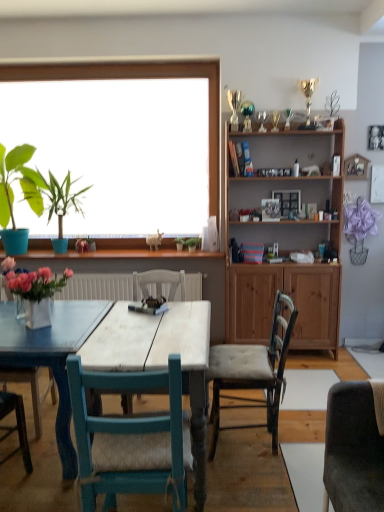
The image size is (384, 512). Identify the location of green leafy plant in blue pot at left. (13, 195).

Describe the element at coordinates (252, 372) in the screenshot. I see `tufted fabric chair at center, which is the first chair from back to front` at that location.

Describe the element at coordinates (121, 350) in the screenshot. I see `white wood table at center` at that location.

Describe the element at coordinates (82, 245) in the screenshot. The width and height of the screenshot is (384, 512). I see `pink matte flower at window` at that location.

The width and height of the screenshot is (384, 512). Find the location of `pink matte flower at window`. pink matte flower at window is located at coordinates (82, 245).

In order to click on green leafy plant in blue pot at left in this screenshot , I will do `click(13, 195)`.

From a real-world perspective, who is located higher, green matte plant at center, placed as the 3th plant when sorted from left to right, or pink matte flower at window?

From a 3D spatial view, pink matte flower at window is above.

Image resolution: width=384 pixels, height=512 pixels. There is a pink matte flower at window. What are the coordinates of `the 2nd plant below it (from a real-world perspective)` in the screenshot? It's located at (193, 243).

Is green matte plant at center, placed as the 3th plant when sorted from left to right, to the right of pink matte flower at window from the viewer's perspective?

Yes.

Who is smaller, green matte plant at center, positioned as the first plant in right-to-left order, or pink matte flower at window?

pink matte flower at window.

Can we say matte blue pot at left, the third plant when ordered from right to left, lies outside white wood table at center?

Yes, matte blue pot at left, the third plant when ordered from right to left, is outside of white wood table at center.

Which of these two, matte blue pot at left, acting as the first plant starting from the left, or white wood table at center, is smaller?

With smaller size is matte blue pot at left, acting as the first plant starting from the left.

Considering the positions of objects matte blue pot at left, the third plant when ordered from right to left, and white wood table at center in the image provided, who is more to the left, matte blue pot at left, the third plant when ordered from right to left, or white wood table at center?

matte blue pot at left, the third plant when ordered from right to left, is more to the left.

Is teal wood chair at center, positioned as the second chair in right-to-left order, next to wooden cabinet at upper right and touching it?

They are not placed beside each other.

From the image's perspective, which is below, teal wood chair at center, arranged as the first chair when viewed from the front, or wooden cabinet at upper right?

teal wood chair at center, arranged as the first chair when viewed from the front.

Image resolution: width=384 pixels, height=512 pixels. I want to click on chair that is the 2nd one when counting forward from the wooden cabinet at upper right, so click(x=131, y=439).

Is teal wood chair at center, positioned as the second chair in back-to-front order, oriented towards wooden cabinet at upper right?

No, teal wood chair at center, positioned as the second chair in back-to-front order, does not turn towards wooden cabinet at upper right.

Is wooden cabinet at upper right a part of matte blue pot at left, the third plant when ordered from right to left?

No, wooden cabinet at upper right is not inside matte blue pot at left, the third plant when ordered from right to left.

In the image, is matte blue pot at left, the third plant when ordered from right to left, on the left side or the right side of wooden cabinet at upper right?

Clearly, matte blue pot at left, the third plant when ordered from right to left, is on the left of wooden cabinet at upper right in the image.

Relative to wooden cabinet at upper right, is matte blue pot at left, the third plant when ordered from right to left, in front or behind?

matte blue pot at left, the third plant when ordered from right to left, is positioned farther from the viewer than wooden cabinet at upper right.

At what (x,y) coordinates should I click in order to perform the action: click on shelf on the right side of matte blue pot at left, acting as the first plant starting from the left. Please return your answer as a coordinate pair (x, y). The image size is (384, 512). Looking at the image, I should click on (285, 242).

Is green leafy plant in blue pot at left at the right side of wooden picture frame at upper center?

In fact, green leafy plant in blue pot at left is to the left of wooden picture frame at upper center.

Would you say green leafy plant in blue pot at left is outside wooden picture frame at upper center?

green leafy plant in blue pot at left is positioned outside wooden picture frame at upper center.

In terms of size, does green leafy plant in blue pot at left appear bigger or smaller than wooden picture frame at upper center?

Considering their sizes, green leafy plant in blue pot at left takes up more space than wooden picture frame at upper center.

Considering the positions of point (28, 191) and point (296, 209), is point (28, 191) closer or farther from the camera than point (296, 209)?

Point (28, 191).

Which object is thinner, green matte plant at center, placed as the 3th plant when sorted from left to right, or tufted fabric chair at center, which is the first chair from back to front?

With smaller width is green matte plant at center, placed as the 3th plant when sorted from left to right.

Consider the image. Considering the positions of objects green matte plant at center, placed as the 3th plant when sorted from left to right, and tufted fabric chair at center, which is counted as the 2th chair, starting from the front, in the image provided, who is in front, green matte plant at center, placed as the 3th plant when sorted from left to right, or tufted fabric chair at center, which is counted as the 2th chair, starting from the front,?

tufted fabric chair at center, which is counted as the 2th chair, starting from the front, is in front.

Is green matte plant at center, positioned as the first plant in right-to-left order, looking in the opposite direction of tufted fabric chair at center, the second chair in the left-to-right sequence?

No.

Based on their sizes in the image, would you say green matte plant at center, placed as the 3th plant when sorted from left to right, is bigger or smaller than tufted fabric chair at center, which is the 1th chair in right-to-left order?

In the image, green matte plant at center, placed as the 3th plant when sorted from left to right, appears to be smaller than tufted fabric chair at center, which is the 1th chair in right-to-left order.

Is tufted fabric chair at center, which is the first chair from back to front, taller or shorter than teal wood chair at center, positioned as the second chair in right-to-left order?

tufted fabric chair at center, which is the first chair from back to front, is shorter than teal wood chair at center, positioned as the second chair in right-to-left order.

Is tufted fabric chair at center, the second chair in the left-to-right sequence, inside the boundaries of teal wood chair at center, which is the 1th chair in left-to-right order, or outside?

tufted fabric chair at center, the second chair in the left-to-right sequence, is located beyond the bounds of teal wood chair at center, which is the 1th chair in left-to-right order.

The height and width of the screenshot is (512, 384). Identify the location of chair that appears below the tufted fabric chair at center, the second chair in the left-to-right sequence (from the image's perspective). (131, 439).

Identify the location of flower above the green matte plant at center, placed as the 3th plant when sorted from left to right (from a real-world perspective). The image size is (384, 512). (82, 245).

Where is `kitchen & dining room table below the matte blue pot at left, acting as the first plant starting from the left (from a real-world perspective)`? The image size is (384, 512). kitchen & dining room table below the matte blue pot at left, acting as the first plant starting from the left (from a real-world perspective) is located at coordinates (121, 350).

From the image, which object appears to be farther from matte blue pot at left, the third plant when ordered from right to left, green leafy plant at center, which is the second plant from left to right, or white wood table at center?

The object further to matte blue pot at left, the third plant when ordered from right to left, is white wood table at center.

Based on their spatial positions, is white wood table at center or matte blue pot at left, acting as the first plant starting from the left, further from wooden cabinet at upper right?

The object further to wooden cabinet at upper right is matte blue pot at left, acting as the first plant starting from the left.

From the image, which object appears to be farther from tufted fabric chair at center, the second chair in the left-to-right sequence, matte blue pot at left, the third plant when ordered from right to left, or pink matte flower at window?

matte blue pot at left, the third plant when ordered from right to left, is further to tufted fabric chair at center, the second chair in the left-to-right sequence.

Based on their spatial positions, is white glossy vase at left or green leafy plant in blue pot at left further from teal wood chair at center, positioned as the second chair in back-to-front order?

green leafy plant in blue pot at left.

Estimate the real-world distances between objects in this image. Which object is further from matte blue pot at left, acting as the first plant starting from the left, wooden picture frame at upper center or white glossy vase at left?

Among the two, wooden picture frame at upper center is located further to matte blue pot at left, acting as the first plant starting from the left.

Which object lies further to the anchor point wooden picture frame at upper center, green matte plant at center, placed as the 3th plant when sorted from left to right, or green leafy plant in blue pot at left?

Based on the image, green leafy plant in blue pot at left appears to be further to wooden picture frame at upper center.

From the image, which object appears to be farther from pink matte flower at window, white wood table at center or green leafy plant at center, which is the second plant from left to right?

white wood table at center lies further to pink matte flower at window than the other object.

Estimate the real-world distances between objects in this image. Which object is further from teal wood chair at center, positioned as the second chair in right-to-left order, green leafy plant in blue pot at left or green matte plant at center, positioned as the first plant in right-to-left order?

green leafy plant in blue pot at left is further to teal wood chair at center, positioned as the second chair in right-to-left order.

Where is `houseplant located between teal wood chair at center, arranged as the first chair when viewed from the front, and green matte plant at center, positioned as the first plant in right-to-left order, in the depth direction`? This screenshot has width=384, height=512. houseplant located between teal wood chair at center, arranged as the first chair when viewed from the front, and green matte plant at center, positioned as the first plant in right-to-left order, in the depth direction is located at coordinates (13, 195).

The image size is (384, 512). I want to click on flower located between green leafy plant in blue pot at left and tufted fabric chair at center, which is the 1th chair in right-to-left order, in the left-right direction, so click(x=82, y=245).

The image size is (384, 512). I want to click on picture frame between tufted fabric chair at center, the second chair in the left-to-right sequence, and green leafy plant at center, arranged as the 2th plant when viewed from the right, from front to back, so click(x=288, y=201).

The width and height of the screenshot is (384, 512). What are the coordinates of `floral arrangement between pink matte flower at window and wooden picture frame at upper center` in the screenshot? It's located at (36, 293).